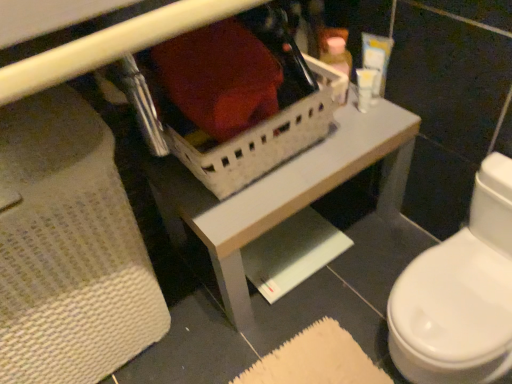
At what (x,y) coordinates should I click in order to perform the action: click on unoccupied area in front of white plastic container at upper center, marked as the 1th toiletry in a left-to-right arrangement. Please return your answer as a coordinate pair (x, y). Looking at the image, I should click on (336, 144).